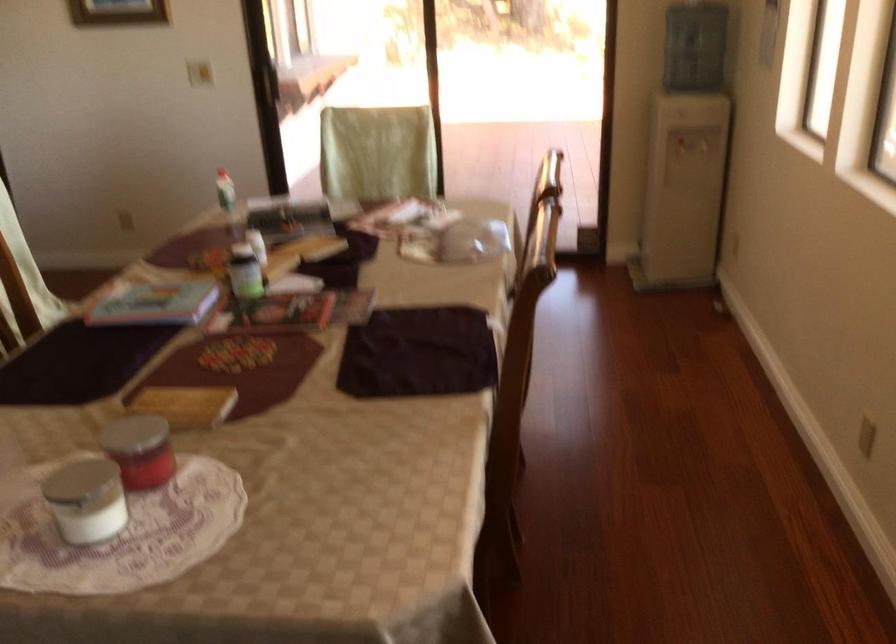
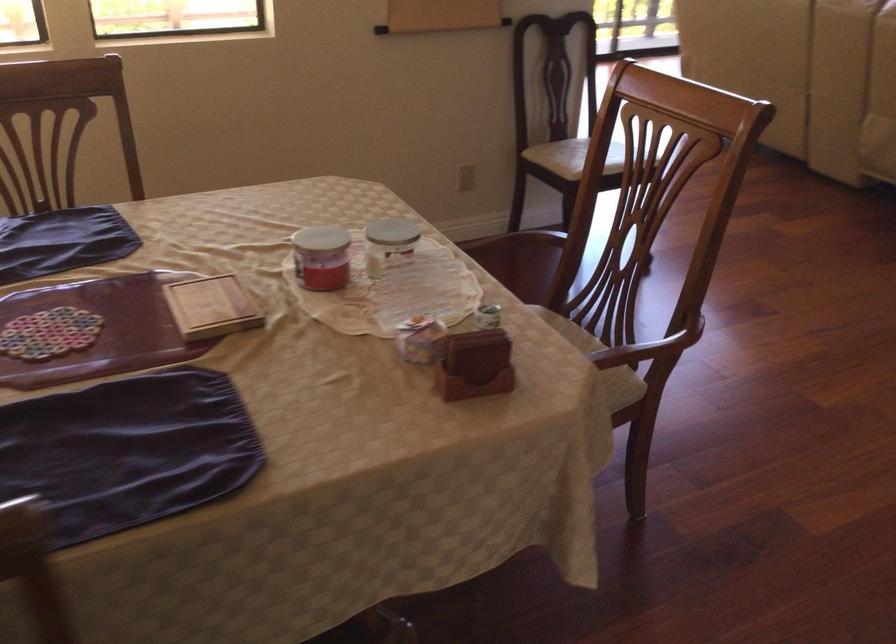
Locate, in the second image, the point that corresponds to pixel 78 476 in the first image.

(389, 243)